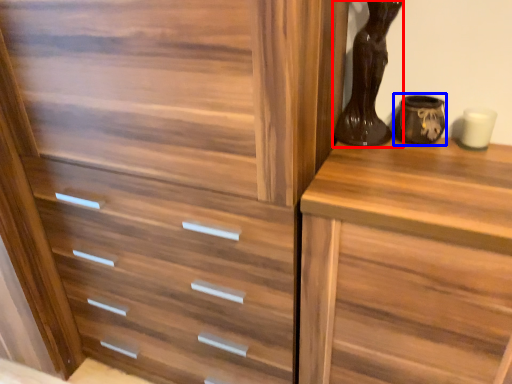
Question: Which object appears farthest to the camera in this image, vase (highlighted by a red box) or vase (highlighted by a blue box)?

Choices:
 (A) vase
 (B) vase

Answer: (B)